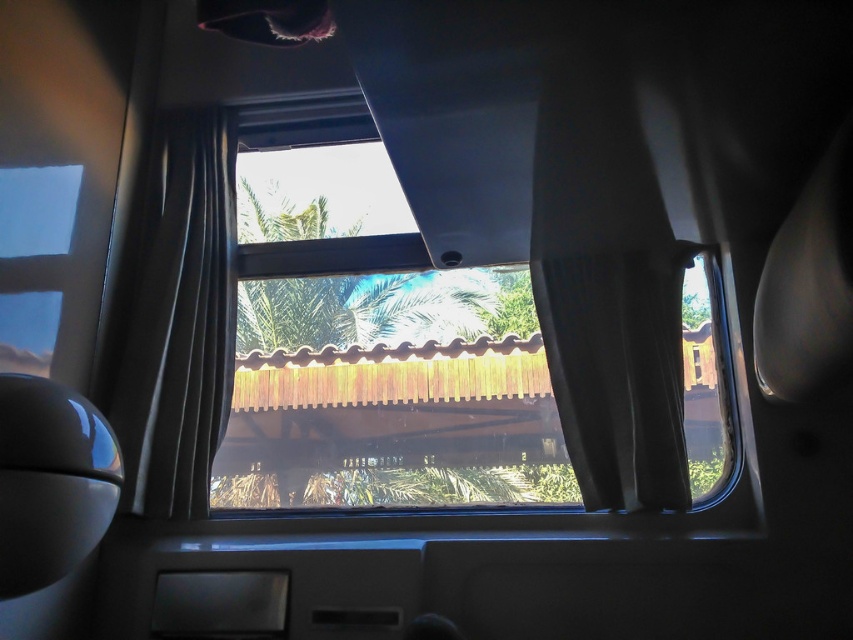
You are a passenger in a car and want to see the palm tree outside better. The black velvet curtain at right is blocking part of your view. Can you tell if the curtain is wider or narrower than the green leafy palm tree at center?

The black velvet curtain at right has a lesser width compared to the green leafy palm tree at center, so the curtain is narrower than the palm tree.

You are a passenger in a car and want to take a photo of the green leafy palm tree at center through the transparent glass window at center. Since the window is wider than the palm tree, will the palm tree fit entirely within the window when taking the photo?

The transparent glass window at center is wider than the green leafy palm tree at center, so the palm tree will fit entirely within the window when taking the photo.

You are a passenger in the vehicle and want to see the outdoor view better. Which curtain, the black fabric curtain at center or the black velvet curtain at right, should you adjust to get a clearer view?

The black fabric curtain at center has a larger size compared to the black velvet curtain at right, so adjusting the black velvet curtain at right would allow for a clearer view since it is smaller and easier to move out of the way.